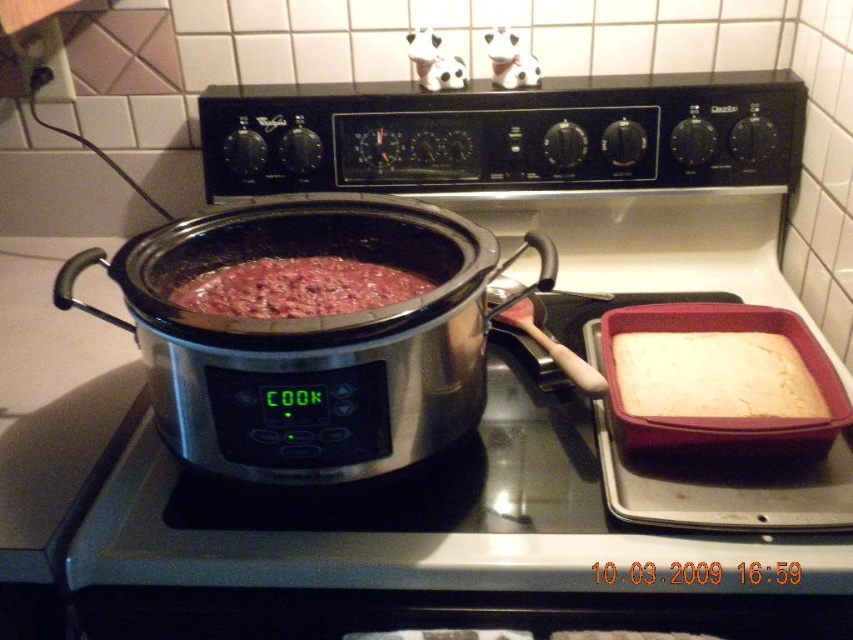
You are a chef in a kitchen with a stovetop. You need to place a new pot on the stovetop. The stovetop has a slow cooker and a baking dish already. Where should you place the new pot so it doesn not overlap with existing items? The coordinates of the existing items are given as points. The new pot requires a space of 0.2 units in width and height. The stovetop is represented as a coordinate system from 0 to 1 in both x and y axes. The existing items are at point (x=436, y=518). Please provide the coordinates.

The point (x=436, y=518) indicates the stainless steel slow cooker at center. Since the stovetop is a coordinate system from 0 to 1, placing the new pot at coordinates like 0.6, 0.4 would leave sufficient space around the existing items, ensuring no overlap. The new pot requires 0.2 units in width and height, so positioning it away from the slow cooker at (x=436, y=518) would work.

You are a chef preparing desserts and need to place a dessert plate between the stainless steel slow cooker at center and the white fluffy cake at right. Where should you place the plate so it is closer to the cake than the slow cooker?

The stainless steel slow cooker at center is located below the white fluffy cake at right, so placing the dessert plate closer to the white fluffy cake at right would position it above the slow cooker, ensuring it is nearer to the cake than the slow cooker.

You are a chef who needs to place a 10 inch long wooden spoon between the stainless steel slow cooker at center and the brown matte pot at center. Can you fit the spoon between them without touching either?

The stainless steel slow cooker at center and brown matte pot at center are 9.60 inches apart. Since the wooden spoon is 10 inches long, it cannot fit between them without touching either object.